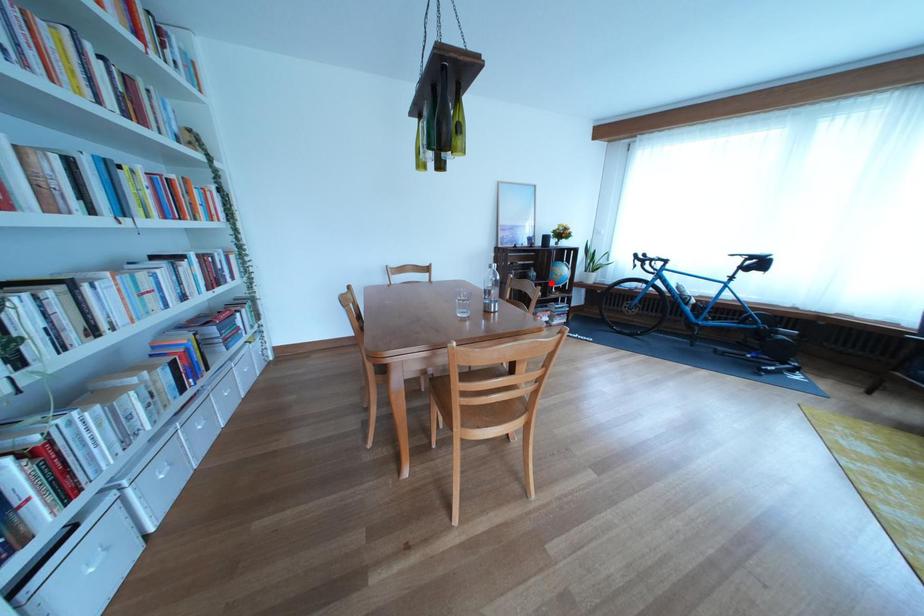
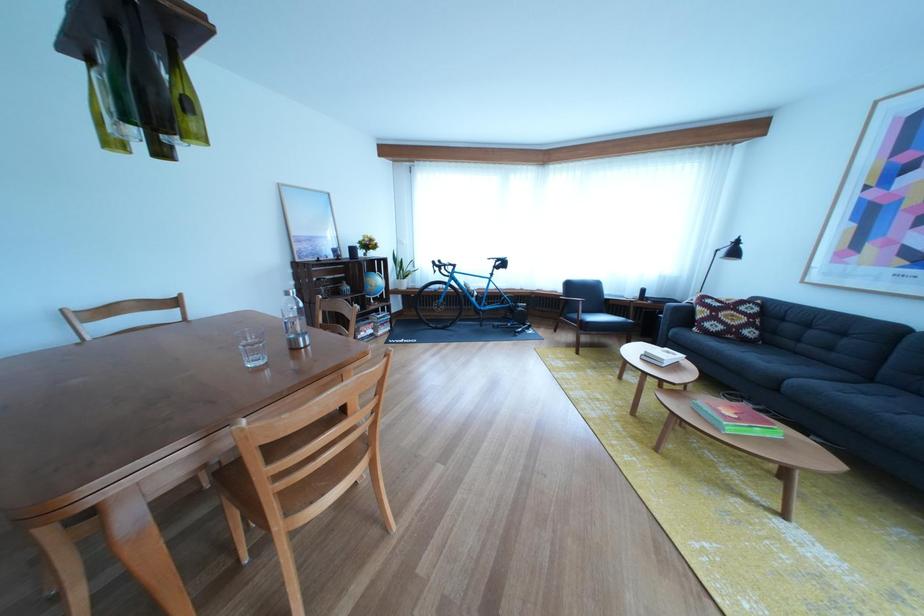
The point at the highlighted location is marked in the first image. Where is the corresponding point in the second image?

(367, 297)